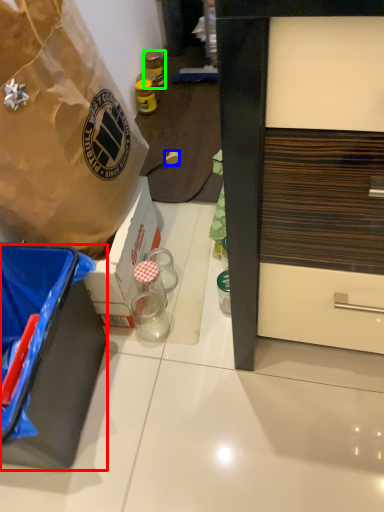
Question: Estimate the real-world distances between objects in this image. Which object is closer to box (highlighted by a red box), power outlet (highlighted by a blue box) or bottle (highlighted by a green box)?

Choices:
 (A) power outlet
 (B) bottle

Answer: (A)